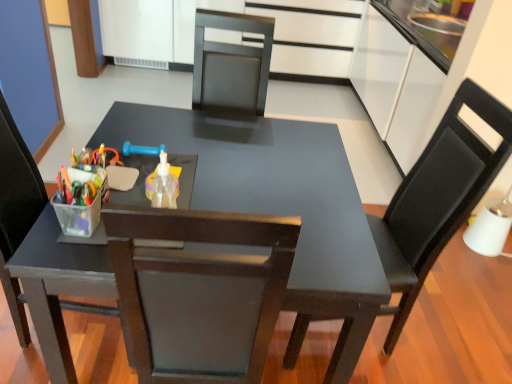
Measure the distance between translucent plastic bottle at center and camera.

translucent plastic bottle at center and camera are 3.76 feet apart.

Locate an element on the screen. This screenshot has width=512, height=384. translucent plastic bottle at center is located at coordinates (164, 185).

You are a GUI agent. You are given a task and a screenshot of the screen. Output one action in this format:
    pyautogui.click(x=<x>, y=<y>)
    Task: Click on the translucent plastic bottle at center
    
    Given the screenshot: What is the action you would take?
    pyautogui.click(x=164, y=185)

Is white glossy drawer at upper center at the back of matte black chair at left, acting as the second chair starting from the right?

No, white glossy drawer at upper center is not at the back of matte black chair at left, acting as the second chair starting from the right.

You are a GUI agent. You are given a task and a screenshot of the screen. Output one action in this format:
    pyautogui.click(x=<x>, y=<y>)
    Task: Click on the 2nd chair in front of the white glossy drawer at upper center, starting your count from the anchor
    The height and width of the screenshot is (384, 512).
    Given the screenshot: What is the action you would take?
    pyautogui.click(x=16, y=210)

Between point (7, 165) and point (340, 33), which one is positioned in front?

The point (7, 165) is closer.

Considering the sizes of objects matte black chair at left, acting as the second chair starting from the right, and white glossy drawer at upper center in the image provided, who is taller, matte black chair at left, acting as the second chair starting from the right, or white glossy drawer at upper center?

matte black chair at left, acting as the second chair starting from the right, is taller.

Is matte black table at center bigger or smaller than translucent plastic bottle at center?

In the image, matte black table at center appears to be larger than translucent plastic bottle at center.

From the picture: Considering the positions of objects matte black table at center and translucent plastic bottle at center in the image provided, who is in front, matte black table at center or translucent plastic bottle at center?

Positioned in front is matte black table at center.

Is matte black table at center next to translucent plastic bottle at center and touching it?

No, matte black table at center is not touching translucent plastic bottle at center.

Is translucent plastic bottle at center surrounded by matte black table at center?

That's incorrect, translucent plastic bottle at center is not inside matte black table at center.

Is translucent plastic bottle at center in contact with matte black chair at left, which is the first chair in left-to-right order?

translucent plastic bottle at center and matte black chair at left, which is the first chair in left-to-right order, are clearly separated.

Is translucent plastic bottle at center aimed at matte black chair at left, acting as the second chair starting from the right?

No, translucent plastic bottle at center is not oriented towards matte black chair at left, acting as the second chair starting from the right.

Where is `bottle behind the matte black chair at left, which is the first chair in left-to-right order`? bottle behind the matte black chair at left, which is the first chair in left-to-right order is located at coordinates (164, 185).

Is translucent plastic bottle at center spatially inside matte black chair at left, acting as the second chair starting from the right, or outside of it?

translucent plastic bottle at center is not enclosed by matte black chair at left, acting as the second chair starting from the right.

Is matte black chair at right, which appears as the 2th chair when viewed from the left, next to white glossy drawer at upper center and touching it?

They are not placed beside each other.

From the image's perspective, is matte black chair at right, which appears as the 2th chair when viewed from the left, beneath white glossy drawer at upper center?

Correct, matte black chair at right, which appears as the 2th chair when viewed from the left, appears lower than white glossy drawer at upper center in the image.

I want to click on chair on the right of white glossy drawer at upper center, so click(437, 198).

Is matte black table at center oriented towards matte black chair at right, which is the first chair from right to left?

No, matte black table at center is not turned towards matte black chair at right, which is the first chair from right to left.

Is matte black table at center not near matte black chair at right, which is the first chair from right to left?

matte black table at center is near matte black chair at right, which is the first chair from right to left, not far away.

Does matte black table at center have a larger size compared to matte black chair at right, which appears as the 2th chair when viewed from the left?

Yes.

Which is more to the right, matte black table at center or matte black chair at right, which appears as the 2th chair when viewed from the left?

Positioned to the right is matte black chair at right, which appears as the 2th chair when viewed from the left.

Does matte black chair at right, which appears as the 2th chair when viewed from the left, have a greater height compared to matte black chair at left, which is the first chair in left-to-right order?

No, matte black chair at right, which appears as the 2th chair when viewed from the left, is not taller than matte black chair at left, which is the first chair in left-to-right order.

Between matte black chair at right, which is the first chair from right to left, and matte black chair at left, which is the first chair in left-to-right order, which one has smaller width?

With smaller width is matte black chair at right, which is the first chair from right to left.

Is matte black chair at left, acting as the second chair starting from the right, completely or partially inside matte black chair at right, which is the first chair from right to left?

Actually, matte black chair at left, acting as the second chair starting from the right, is outside matte black chair at right, which is the first chair from right to left.

How many degrees apart are the facing directions of matte black chair at right, which is the first chair from right to left, and matte black chair at left, acting as the second chair starting from the right?

matte black chair at right, which is the first chair from right to left, and matte black chair at left, acting as the second chair starting from the right, are facing 169 degrees away from each other.

Are matte black chair at right, which appears as the 2th chair when viewed from the left, and matte black table at center far apart?

No, matte black chair at right, which appears as the 2th chair when viewed from the left, is not far away from matte black table at center.

Is point (399, 304) more distant than point (201, 322)?

Yes, it is.

Between matte black chair at right, which is the first chair from right to left, and matte black table at center, which one appears on the right side from the viewer's perspective?

Positioned to the right is matte black chair at right, which is the first chair from right to left.

I want to click on the 2nd chair in front of the white glossy drawer at upper center, so click(16, 210).

Locate an element on the screen. bottle that is on the left side of matte black table at center is located at coordinates pyautogui.click(x=164, y=185).

Which object lies further to the anchor point translucent plastic bottle at center, matte black table at center or matte black chair at right, which appears as the 2th chair when viewed from the left?

matte black chair at right, which appears as the 2th chair when viewed from the left, is further to translucent plastic bottle at center.

Estimate the real-world distances between objects in this image. Which object is closer to matte black table at center, matte black chair at left, acting as the second chair starting from the right, or translucent plastic bottle at center?

The object closer to matte black table at center is translucent plastic bottle at center.

Looking at the image, which one is located further to white glossy drawer at upper center, translucent plastic bottle at center or matte black table at center?

translucent plastic bottle at center is positioned further to the anchor white glossy drawer at upper center.

When comparing their distances from translucent plastic bottle at center, does matte black table at center or matte black chair at left, acting as the second chair starting from the right, seem further?

The object further to translucent plastic bottle at center is matte black chair at left, acting as the second chair starting from the right.

From the image, which object appears to be farther from matte black chair at right, which appears as the 2th chair when viewed from the left, translucent plastic bottle at center or matte black chair at left, acting as the second chair starting from the right?

Among the two, matte black chair at left, acting as the second chair starting from the right, is located further to matte black chair at right, which appears as the 2th chair when viewed from the left.

Considering their positions, is matte black chair at left, which is the first chair in left-to-right order, positioned further to matte black table at center than matte black chair at right, which is the first chair from right to left?

Among the two, matte black chair at left, which is the first chair in left-to-right order, is located further to matte black table at center.

When comparing their distances from white glossy drawer at upper center, does matte black chair at left, which is the first chair in left-to-right order, or translucent plastic bottle at center seem closer?

Based on the image, translucent plastic bottle at center appears to be nearer to white glossy drawer at upper center.

Which object lies further to the anchor point white glossy drawer at upper center, matte black table at center or matte black chair at left, acting as the second chair starting from the right?

The object further to white glossy drawer at upper center is matte black chair at left, acting as the second chair starting from the right.

Locate an element on the screen. bottle located between matte black table at center and white glossy drawer at upper center in the depth direction is located at coordinates (164, 185).

Find the location of a particular element. The width and height of the screenshot is (512, 384). bottle between matte black chair at right, which is the first chair from right to left, and white glossy drawer at upper center in the front-back direction is located at coordinates (164, 185).

Find the location of a particular element. The image size is (512, 384). chair located between matte black chair at left, which is the first chair in left-to-right order, and white glossy drawer at upper center in the depth direction is located at coordinates (437, 198).

Identify the location of bottle between matte black chair at left, acting as the second chair starting from the right, and matte black table at center, in the horizontal direction. This screenshot has width=512, height=384. (164, 185).